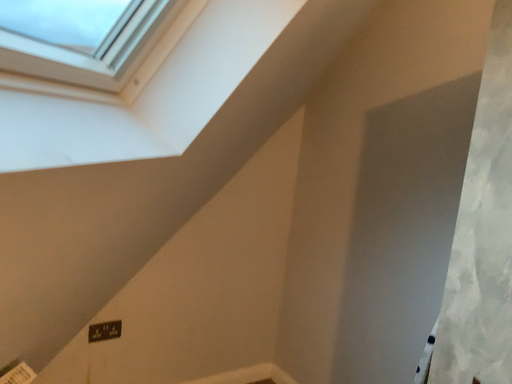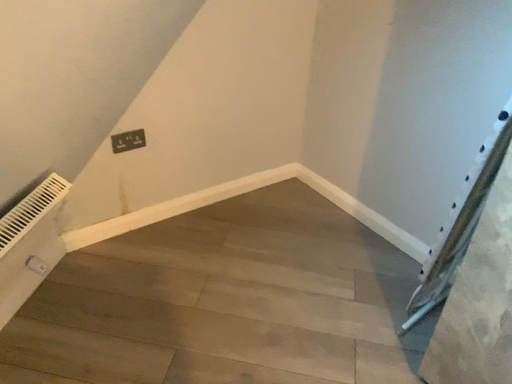
Question: Which way did the camera rotate in the video?

Choices:
 (A) rotated downward
 (B) rotated upward

Answer: (A)